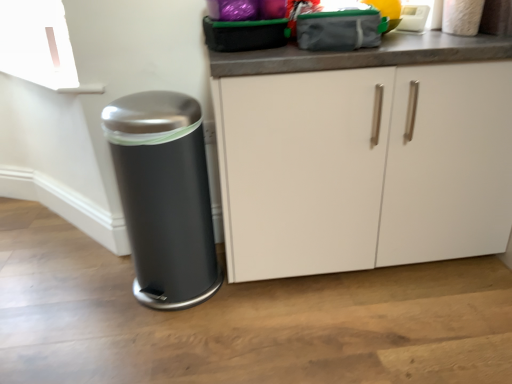
Identify the location of free space in front of white matte cabinet at center. This screenshot has height=384, width=512. (374, 324).